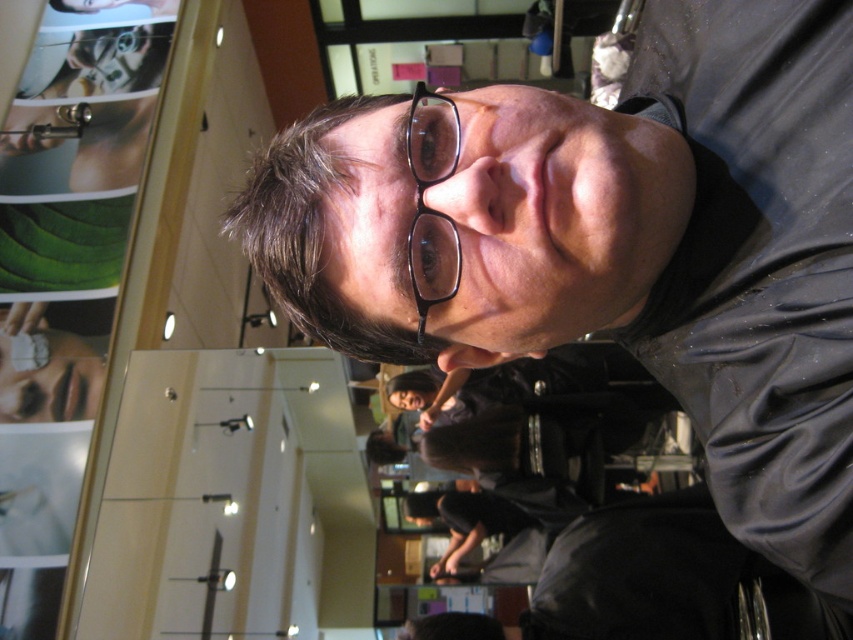
Question: Which point appears farthest from the camera in this image?

Choices:
 (A) (726, 33)
 (B) (444, 250)

Answer: (A)

Question: Is matte black glasses at upper center below black plastic glasses at center?

Choices:
 (A) no
 (B) yes

Answer: (A)

Question: Does matte black glasses at upper center have a smaller size compared to black plastic glasses at center?

Choices:
 (A) yes
 (B) no

Answer: (B)

Question: Can you confirm if matte black glasses at upper center is positioned above black plastic glasses at center?

Choices:
 (A) no
 (B) yes

Answer: (B)